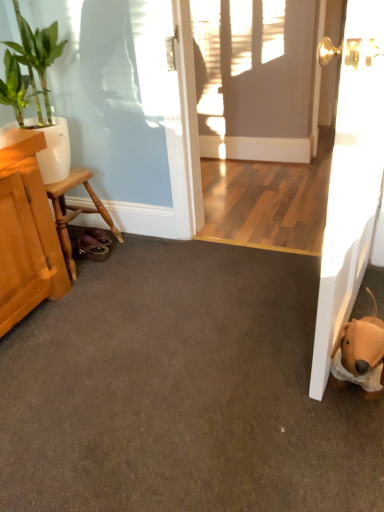
Question: In the image, is white glossy door at right positioned in front of or behind wooden stool at left?

Choices:
 (A) front
 (B) behind

Answer: (A)

Question: In the image, is white glossy door at right on the left side or the right side of wooden stool at left?

Choices:
 (A) right
 (B) left

Answer: (A)

Question: Estimate the real-world distances between objects in this image. Which object is closer to the green glossy plant at upper left?

Choices:
 (A) white glossy door at right
 (B) wooden stool at left
 (C) brown plush dog at lower right

Answer: (B)

Question: Considering the real-world distances, which object is farthest from the brown plush dog at lower right?

Choices:
 (A) green glossy plant at upper left
 (B) white glossy door at right
 (C) wooden stool at left

Answer: (A)